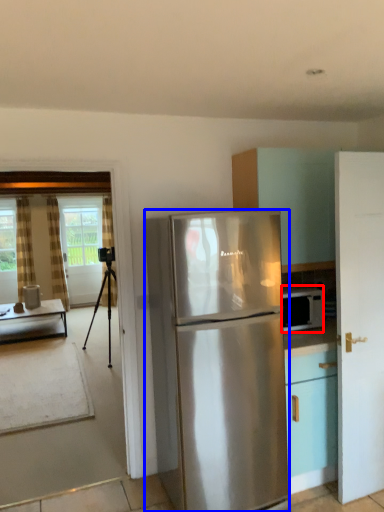
Question: Which object appears closest to the camera in this image, microwave oven (highlighted by a red box) or refrigerator (highlighted by a blue box)?

Choices:
 (A) microwave oven
 (B) refrigerator

Answer: (B)